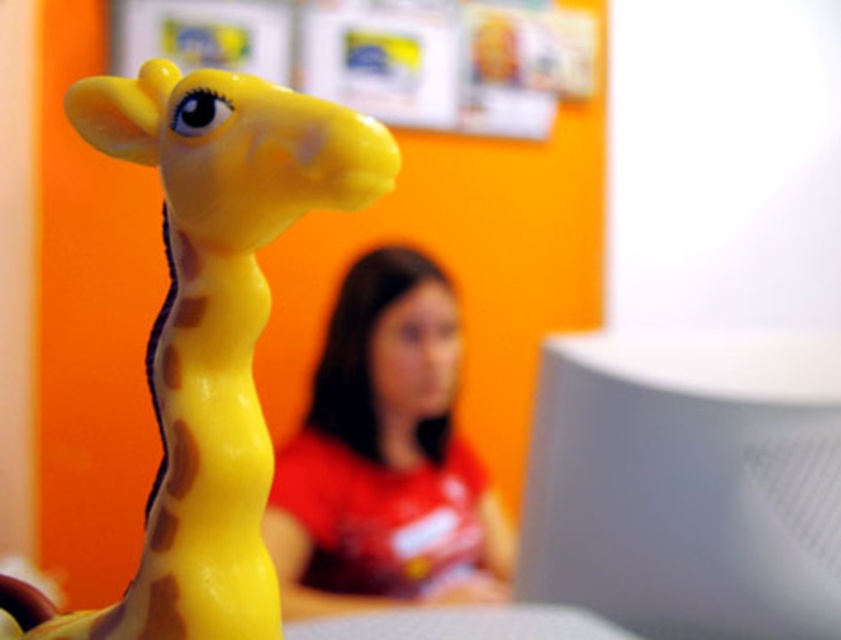
Is point (632, 592) closer to viewer compared to point (463, 536)?

Yes, it is in front of point (463, 536).

What do you see at coordinates (686, 483) in the screenshot?
I see `white matte computer monitor at right` at bounding box center [686, 483].

At what (x,y) coordinates should I click in order to perform the action: click on white matte computer monitor at right. Please return your answer as a coordinate pair (x, y). Looking at the image, I should click on (686, 483).

In the scene shown: Does matte plastic giraffe at center appear under matte red shirt at center?

No.

Can you confirm if matte plastic giraffe at center is positioned above matte red shirt at center?

Indeed, matte plastic giraffe at center is positioned over matte red shirt at center.

Where is `matte plastic giraffe at center`? matte plastic giraffe at center is located at coordinates (210, 332).

Identify the location of matte plastic giraffe at center. The width and height of the screenshot is (841, 640). (210, 332).

Is white matte computer monitor at right to the left of matte plastic giraffe at center from the viewer's perspective?

No, white matte computer monitor at right is not to the left of matte plastic giraffe at center.

From the picture: Does white matte computer monitor at right have a lesser height compared to matte plastic giraffe at center?

Yes.

Is point (644, 492) in front of point (246, 83)?

No, (644, 492) is behind (246, 83).

Find the location of a particular element. The height and width of the screenshot is (640, 841). white matte computer monitor at right is located at coordinates (686, 483).